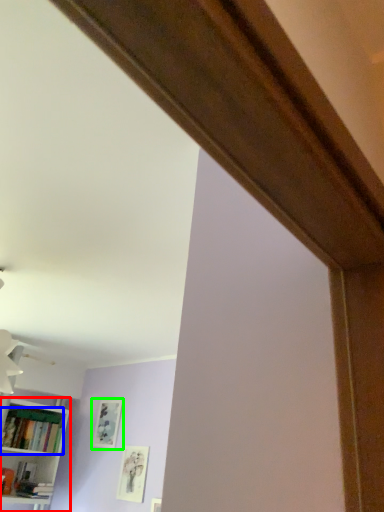
Question: Which object is positioned farthest from bookcase (highlighted by a red box)? Select from book (highlighted by a blue box) and picture frame (highlighted by a green box).

Choices:
 (A) book
 (B) picture frame

Answer: (B)